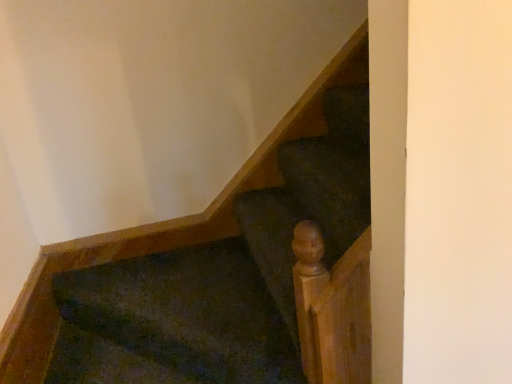
What is the approximate width of dark green carpet at center?

It is 34.83 inches.

Describe the element at coordinates (173, 322) in the screenshot. I see `dark green carpet at center` at that location.

The height and width of the screenshot is (384, 512). Find the location of `dark green carpet at center`. dark green carpet at center is located at coordinates (173, 322).

Image resolution: width=512 pixels, height=384 pixels. I want to click on dark green carpet at center, so click(173, 322).